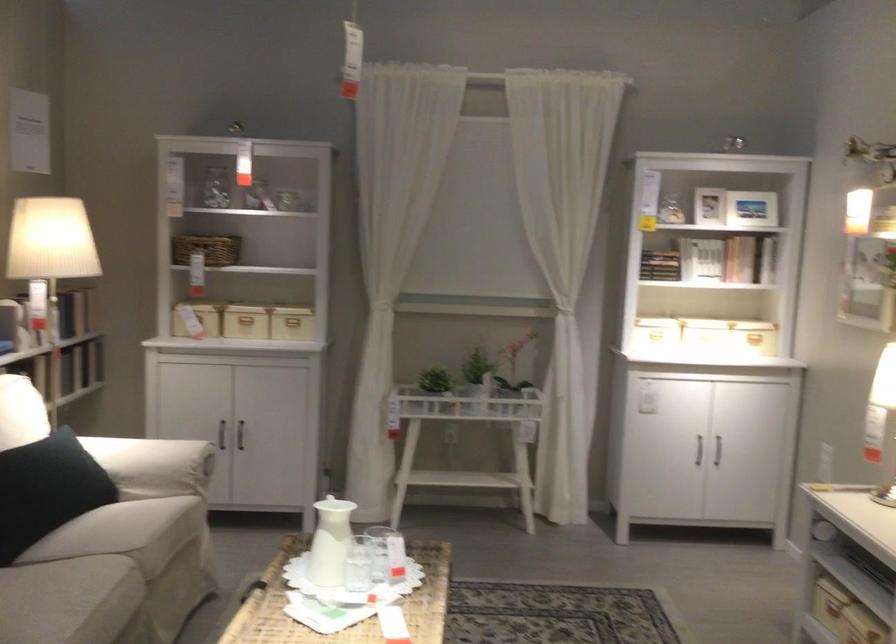
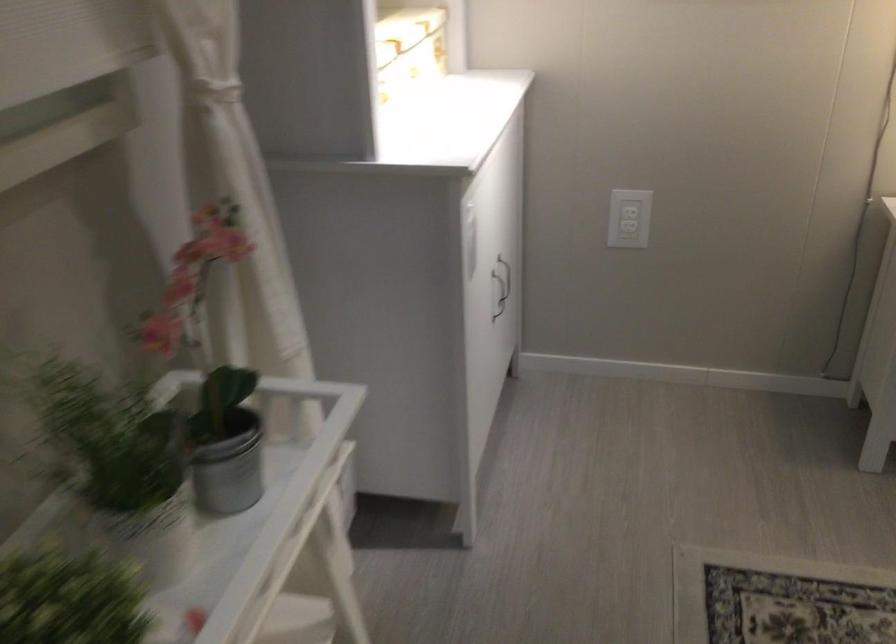
In the second image, find the point that corresponds to point 530,393 in the first image.

(227, 462)